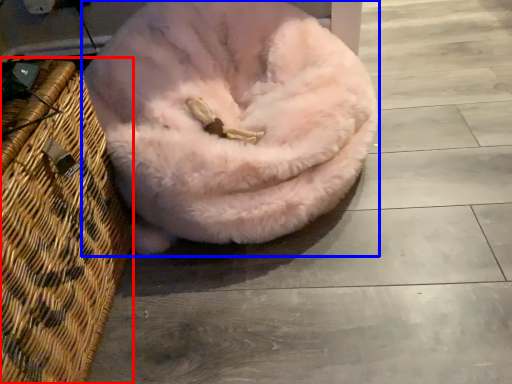
Question: Which of the following is the closest to the observer, basket (highlighted by a red box) or dog bed (highlighted by a blue box)?

Choices:
 (A) basket
 (B) dog bed

Answer: (A)